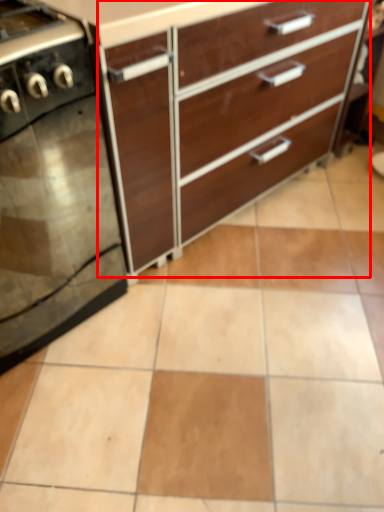
Question: From the image's perspective, what is the correct spatial relationship of chest of drawers (annotated by the red box) in relation to home appliance?

Choices:
 (A) above
 (B) below

Answer: (A)